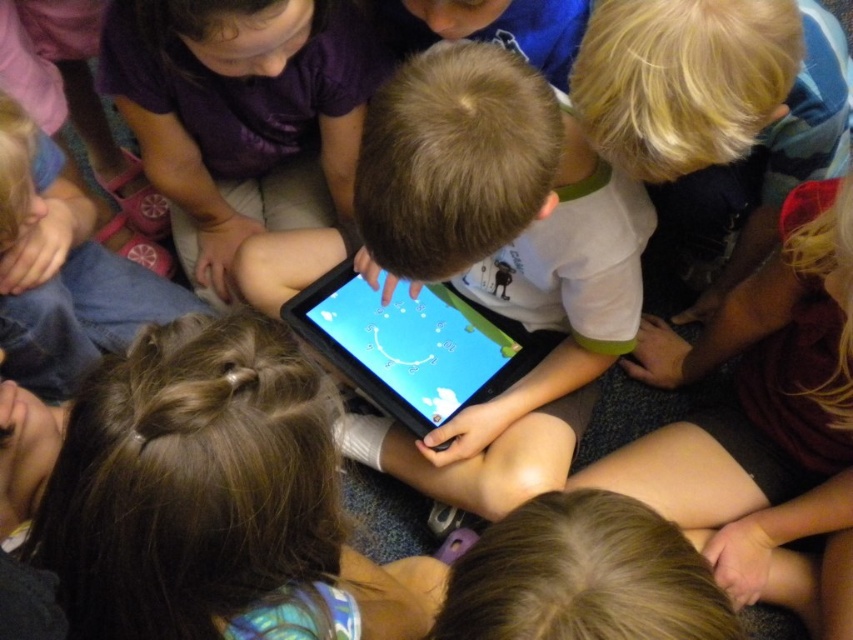
Question: Is smooth black tablet at center bigger than black plastic tablet at center?

Choices:
 (A) no
 (B) yes

Answer: (B)

Question: Which object is closer to the camera taking this photo?

Choices:
 (A) smooth black tablet at center
 (B) black plastic tablet at center

Answer: (A)

Question: Which point is closer to the camera taking this photo?

Choices:
 (A) (434, 403)
 (B) (460, 68)

Answer: (B)

Question: Does smooth black tablet at center appear on the left side of black plastic tablet at center?

Choices:
 (A) yes
 (B) no

Answer: (B)

Question: Where is smooth black tablet at center located in relation to black plastic tablet at center in the image?

Choices:
 (A) above
 (B) below

Answer: (A)

Question: Which point is farther to the camera?

Choices:
 (A) (432, 400)
 (B) (519, 208)

Answer: (A)